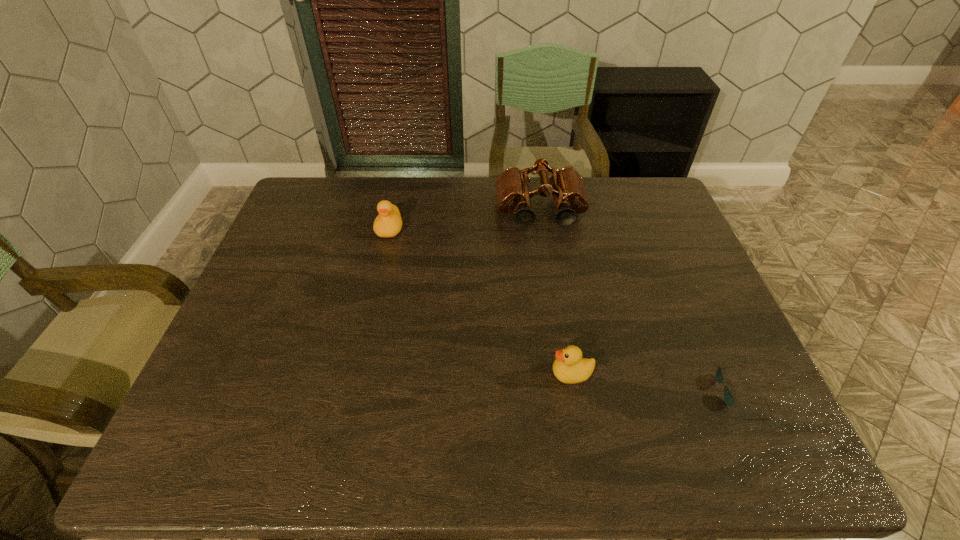
Identify the location of free space located 0.050m at the beak of the right duck. The width and height of the screenshot is (960, 540). (530, 374).

This screenshot has height=540, width=960. Identify the location of vacant space located on the lenses of the sunglasses. tap(547, 390).

Where is `vacant space located on the lenses of the sunglasses`? This screenshot has height=540, width=960. vacant space located on the lenses of the sunglasses is located at coordinates [579, 390].

Where is `free space located on the lenses of the sunglasses`? This screenshot has height=540, width=960. free space located on the lenses of the sunglasses is located at coordinates (674, 390).

Where is `binoculars located in the far edge section of the desktop`? This screenshot has height=540, width=960. binoculars located in the far edge section of the desktop is located at coordinates (513, 186).

Find the location of `duck present at the far edge`. duck present at the far edge is located at coordinates (388, 223).

Where is `object present at the right edge`? object present at the right edge is located at coordinates (x=728, y=397).

Image resolution: width=960 pixels, height=540 pixels. In the image, there is a desktop. Identify the location of vacant area at the far edge. (463, 194).

Locate an element on the screen. free location at the near edge is located at coordinates (704, 460).

At what (x,y) coordinates should I click in order to perform the action: click on vacant area at the left edge. Please return your answer as a coordinate pair (x, y). Looking at the image, I should click on (274, 247).